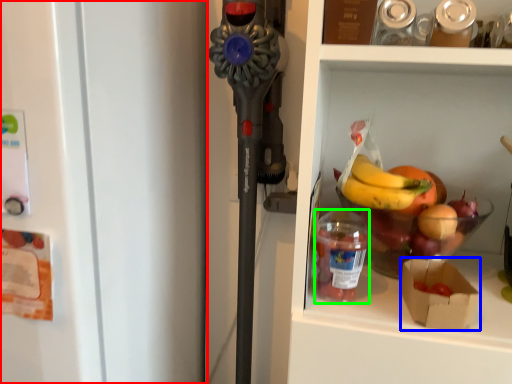
Question: Based on their relative distances, which object is nearer to refrigerator (highlighted by a red box)? Choose from box (highlighted by a blue box) and bottle (highlighted by a green box).

Choices:
 (A) box
 (B) bottle

Answer: (B)